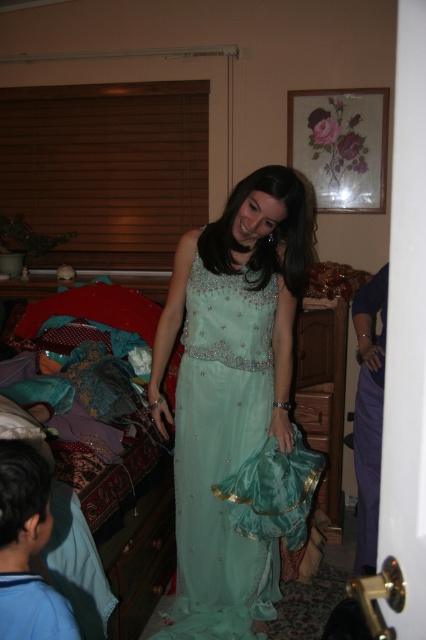
You are a fashion designer trying to decide which garment to display in the center of the runway. The two options are the satin teal dress at center and the teal satin gown at center. Based on their widths, which one would occupy more space on the runway?

The satin teal dress at center is wider than the teal satin gown at center, so it would occupy more space on the runway.

You are standing in the bedroom and want to move from the point at coordinates point (296, 253) to the point at coordinates point (359, 461). Which direction should you move?

You should move backward because point (296, 253) is in front of point (359, 461), so moving backward will take you towards the latter point.

You are a photographer standing at a certain distance from the satin teal dress at center. You want to capture a closeup shot of the dress without moving the dress. What is the minimum distance you need to move towards the dress to achieve this?

The minimum distance you need to move towards the satin teal dress at center is 5.32 feet to achieve the closeup shot.